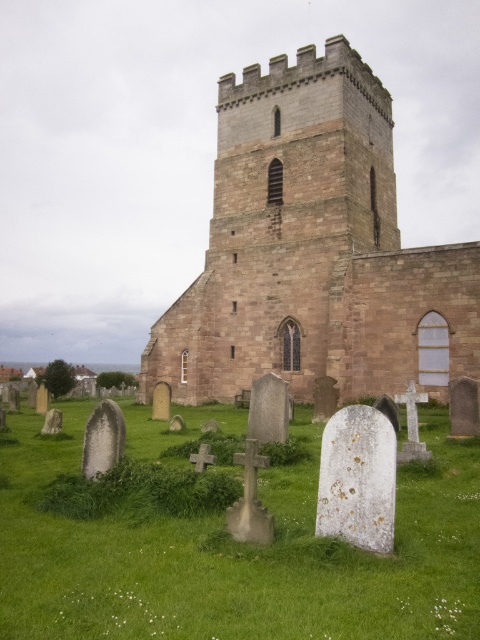
Image resolution: width=480 pixels, height=640 pixels. What do you see at coordinates (312, 250) in the screenshot? I see `brown stone church at center` at bounding box center [312, 250].

Is brown stone church at center to the left of green grass at lower center from the viewer's perspective?

No, brown stone church at center is not to the left of green grass at lower center.

Does point (376, 308) come behind point (351, 598)?

Yes, it is.

The height and width of the screenshot is (640, 480). Find the location of `brown stone church at center`. brown stone church at center is located at coordinates (312, 250).